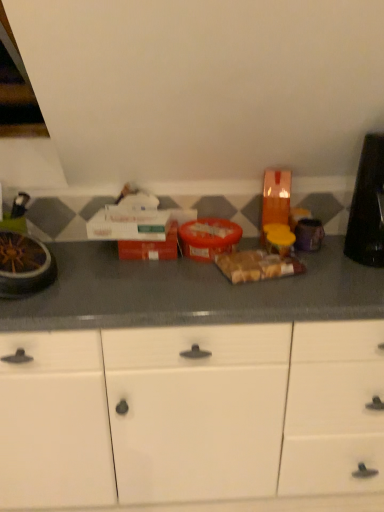
At what (x,y) coordinates should I click in order to perform the action: click on free space in front of translucent plastic bag of bread at center. Please return your answer as a coordinate pair (x, y). Image resolution: width=384 pixels, height=512 pixels. Looking at the image, I should click on (265, 292).